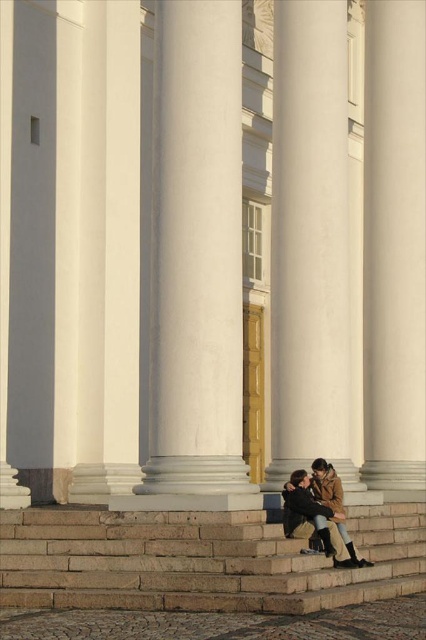
You are standing in front of the grand building with classical architecture. There is a point marked at coordinates (195, 253). Based on the scene description, can you determine which architectural element this point is located on?

The point at coordinates (195, 253) is located on the white marble column at center.

You are a photographer trying to capture a closeup shot of the brown leather jacket at lower center without the white marble column at center obstructing the view. Given their sizes, do you think this is possible?

The white marble column at center is larger in size than brown leather jacket at lower center, so it might obstruct the view. To capture the jacket without obstruction, you need to position yourself so that the smaller jacket is framed in a way that avoids the larger column.